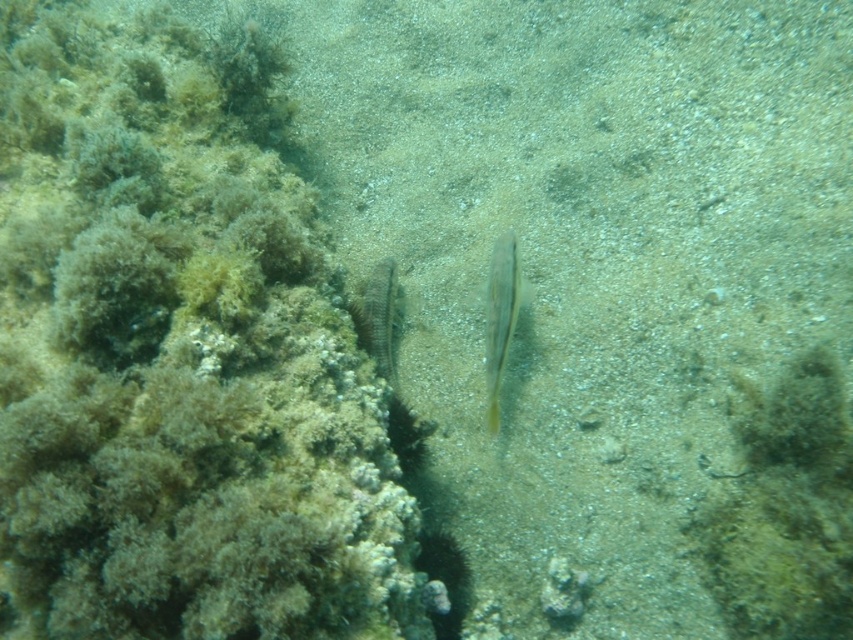
Does point (102, 536) come farther from viewer compared to point (505, 246)?

No, it is in front of (505, 246).

Is greenish-brown textured coral reef at left closer to camera compared to yellow translucent fish at center?

That is True.

Image resolution: width=853 pixels, height=640 pixels. Find the location of `greenish-brown textured coral reef at left`. greenish-brown textured coral reef at left is located at coordinates (177, 364).

The width and height of the screenshot is (853, 640). I want to click on greenish-brown textured coral reef at left, so click(x=177, y=364).